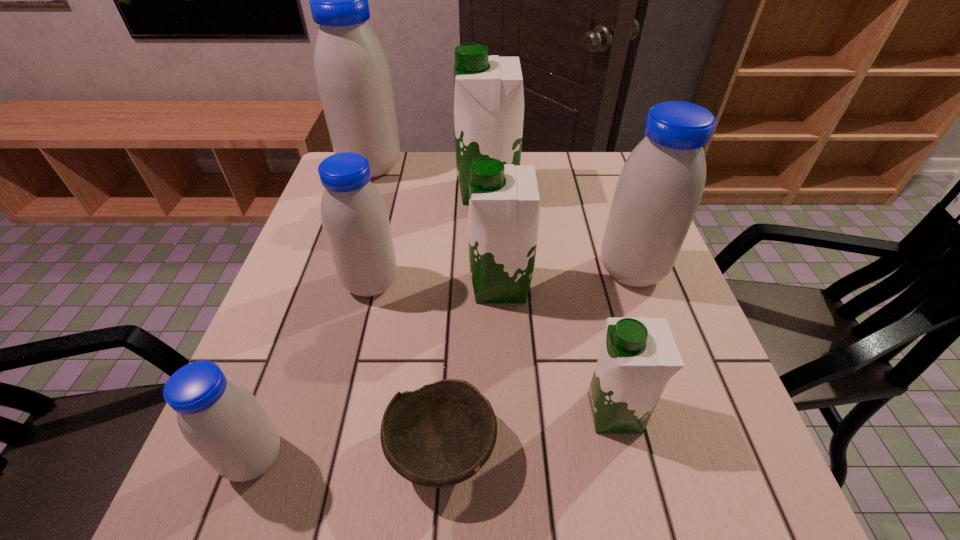
Find the location of a particular element. the tallest soya milk is located at coordinates (352, 73).

Identify the location of the farthest blue soya milk. (352, 73).

This screenshot has height=540, width=960. What are the coordinates of `the farthest green soya milk` in the screenshot? It's located at tap(489, 98).

This screenshot has width=960, height=540. Find the location of `the rightmost blue soya milk`. the rightmost blue soya milk is located at coordinates (x=659, y=189).

Find the location of a particular element. The width and height of the screenshot is (960, 540). the second nearest green soya milk is located at coordinates (504, 205).

Locate an element on the screen. the second smallest blue soya milk is located at coordinates click(x=355, y=220).

Find the location of a particular element. the nearest green soya milk is located at coordinates (639, 355).

You are a GUI agent. You are given a task and a screenshot of the screen. Output one action in this format:
    pyautogui.click(x=<x>, y=<y>)
    Task: Click on the rightmost green soya milk
    The width and height of the screenshot is (960, 540).
    Given the screenshot: What is the action you would take?
    pyautogui.click(x=639, y=355)

In order to click on the smallest blue soya milk in this screenshot , I will do `click(220, 418)`.

Image resolution: width=960 pixels, height=540 pixels. Find the location of `the shortest object`. the shortest object is located at coordinates (442, 434).